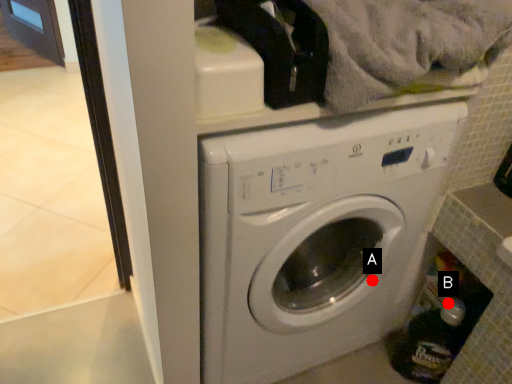
Question: Two points are circled on the image, labeled by A and B beside each circle. Among these points, which one is nearest to the camera?

Choices:
 (A) A is closer
 (B) B is closer

Answer: (A)